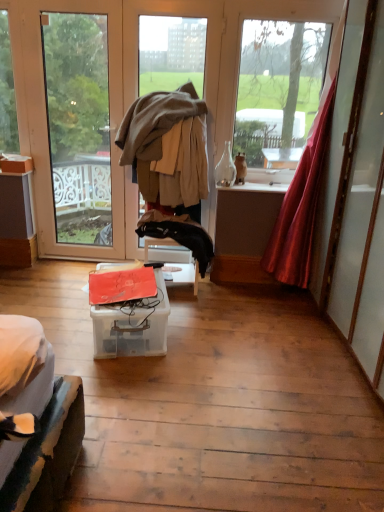
You are a GUI agent. You are given a task and a screenshot of the screen. Output one action in this format:
    pyautogui.click(x=<x>, y=<y>)
    Task: Click on the vacant space in front of clear glass bottle at center
    The width and height of the screenshot is (384, 512).
    Given the screenshot: What is the action you would take?
    pyautogui.click(x=232, y=187)